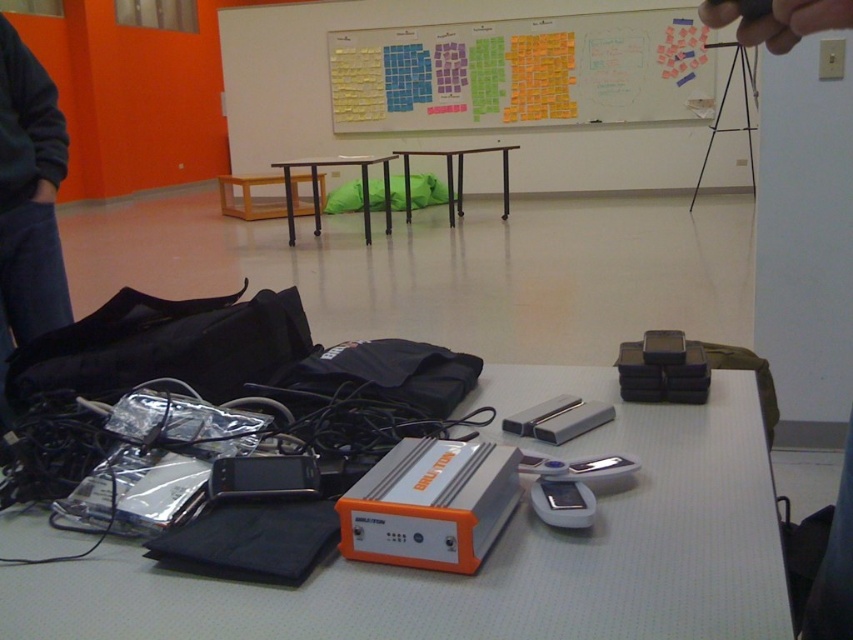
In the room with the cluttered table and orange wall, there is a point marked at coordinates (x=498, y=550). What object is located at this point?

The point at coordinates (x=498, y=550) marks the orange plastic device at center.

You are organizing the items in the room and need to place a new item between the colorful sticky notes at upper center and the dark blue jeans at lower left. Based on their positions, where should you place the new item?

The new item should be placed between the colorful sticky notes at upper center and the dark blue jeans at lower left, which would be somewhere in the middle area between them since the sticky notes are above the jeans.